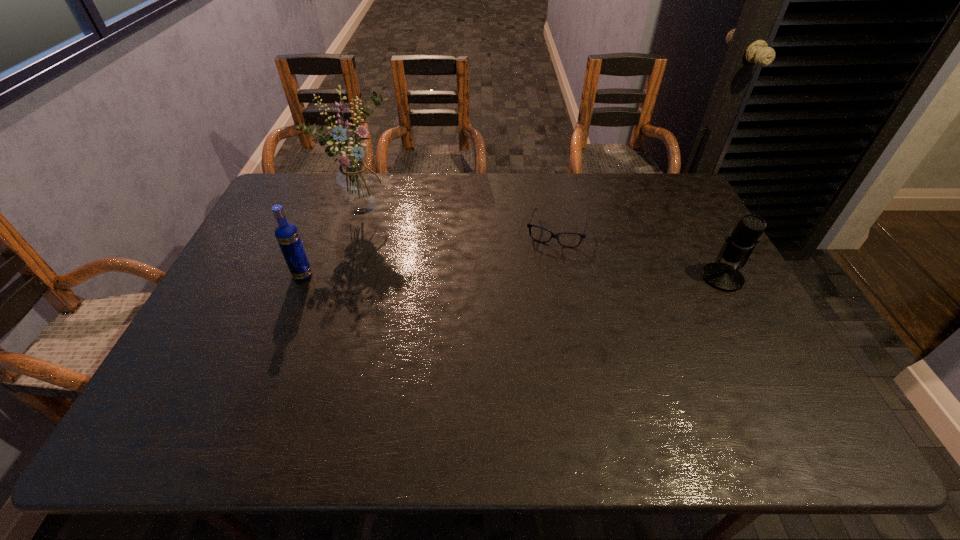
Find the location of a particular element. This screenshot has height=540, width=960. vodka is located at coordinates (287, 235).

The width and height of the screenshot is (960, 540). I want to click on microphone, so coord(738,246).

Image resolution: width=960 pixels, height=540 pixels. I want to click on the second object from right to left, so click(529, 225).

Where is `spectacles`? spectacles is located at coordinates (529, 225).

Identify the location of bouquet. (357, 189).

Locate an element on the screen. free location located 0.290m on the right of the vodka is located at coordinates (415, 275).

The height and width of the screenshot is (540, 960). I want to click on blank space located on the front of the microphone, so click(x=777, y=377).

The height and width of the screenshot is (540, 960). Find the location of `vacant space positioned 0.380m on the front-facing side of the third object from left to right`. vacant space positioned 0.380m on the front-facing side of the third object from left to right is located at coordinates (521, 346).

Find the location of a particular element. This screenshot has width=960, height=540. vacant area located 0.330m on the front-facing side of the third object from left to right is located at coordinates (526, 330).

Locate an element on the screen. The image size is (960, 540). free location located 0.250m on the front-facing side of the third object from left to right is located at coordinates (533, 307).